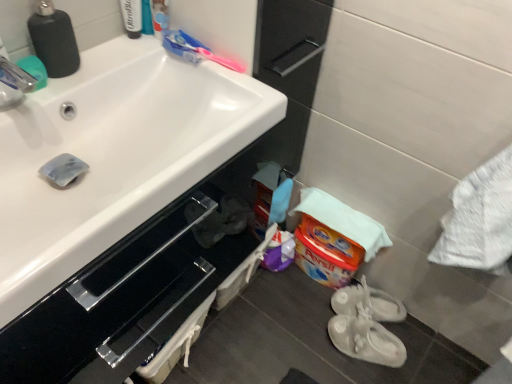
Find the location of a particular element. The image size is (512, 384). free space that is in between white glossy tube at upper left, which ranks as the 2th toiletry in right-to-left order, and black matte soap dispenser at upper left is located at coordinates (109, 53).